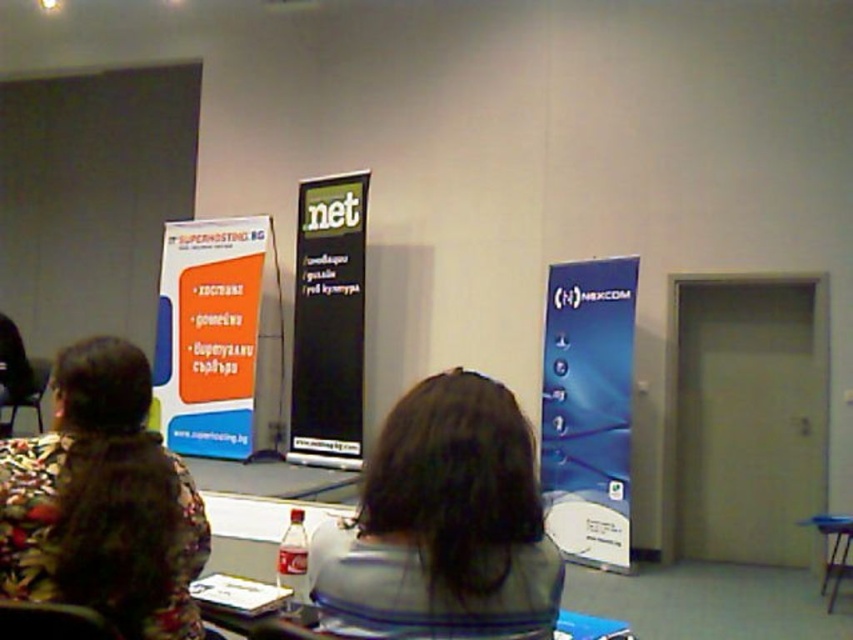
You are standing in the conference room and want to determine which of the two points, point (486, 429) or point (572, 388), is nearer to you. Based on the scene, which point is closer?

Point (486, 429) is closer to the camera than point (572, 388), so it is the nearer one.

You are organizing a small event and need to arrange seating for two guests. You see the gray fabric shirt at center and the floral fabric jacket at left in the image. Which guest is sitting closer to the front of the table?

The gray fabric shirt at center is sitting closer to the front of the table because it is positioned above the floral fabric jacket at left, indicating a more forward position.

You are organizing a presentation and need to ensure that the gray fabric shirt at center is visible to all attendees. Given the blue glossy banner at right is behind it, will the banner obscure the view of the shirt?

The gray fabric shirt at center has a smaller size compared to blue glossy banner at right, so the banner may partially or fully obscure the view of the shirt depending on their positions.